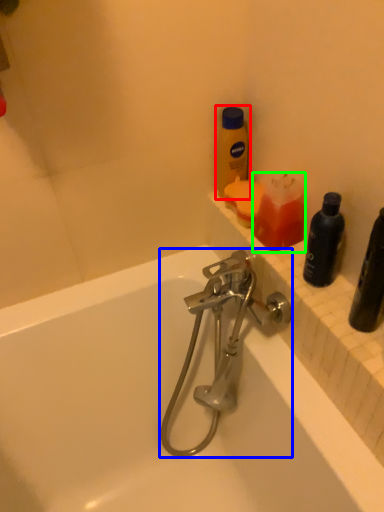
Question: Estimate the real-world distances between objects in this image. Which object is farther from bottle (highlighted by a red box), tap (highlighted by a blue box) or cleaning product (highlighted by a green box)?

Choices:
 (A) tap
 (B) cleaning product

Answer: (A)